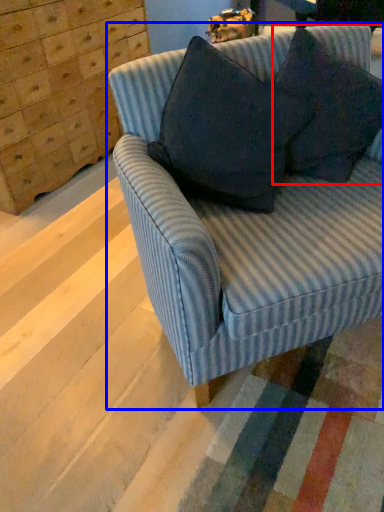
Question: Which of the following is the closest to the observer, throw pillow (highlighted by a red box) or studio couch (highlighted by a blue box)?

Choices:
 (A) throw pillow
 (B) studio couch

Answer: (B)